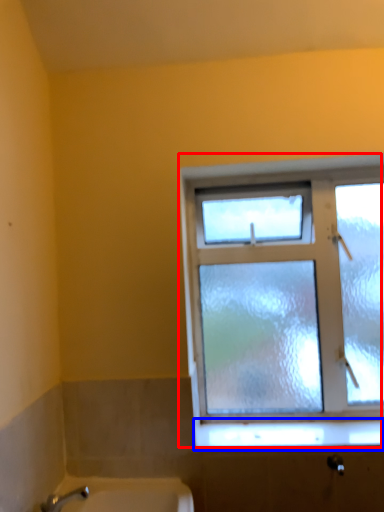
Question: Which point is closer to the camera, window (highlighted by a red box) or window sill (highlighted by a blue box)?

Choices:
 (A) window
 (B) window sill

Answer: (B)